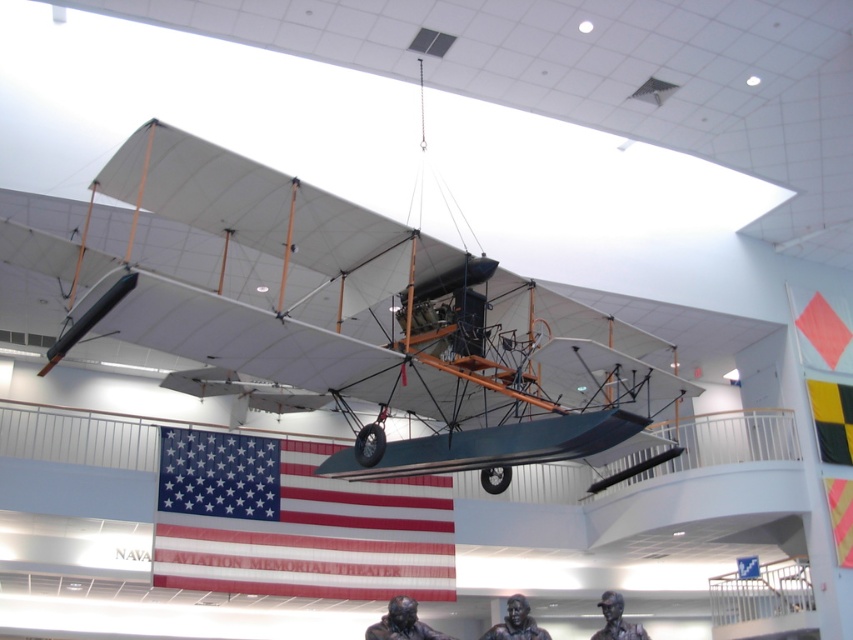
You are standing in the museum and want to take a photo of the vintage biplane. You notice two points marked on the floor at coordinates point (825, 404) and point (842, 513). Which point should you stand at to ensure the biplane is fully visible without any obstructions?

You should stand at point (842, 513) because point (825, 404) is behind it, meaning the biplane might be obstructed from that position.